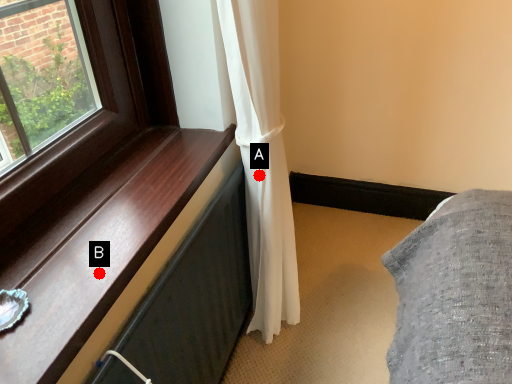
Question: Two points are circled on the image, labeled by A and B beside each circle. Among these points, which one is nearest to the camera?

Choices:
 (A) A is closer
 (B) B is closer

Answer: (B)